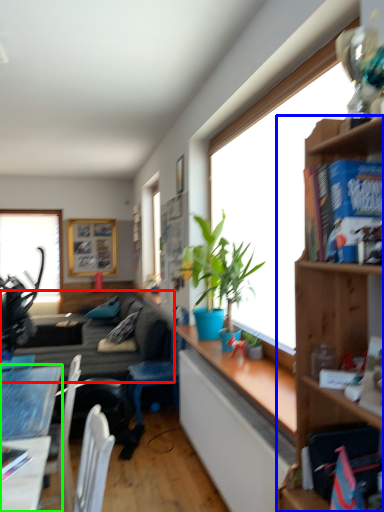
Question: Considering the real-world distances, which object is farthest from studio couch (highlighted by a red box)? shelf (highlighted by a blue box) or desk (highlighted by a green box)?

Choices:
 (A) shelf
 (B) desk

Answer: (A)